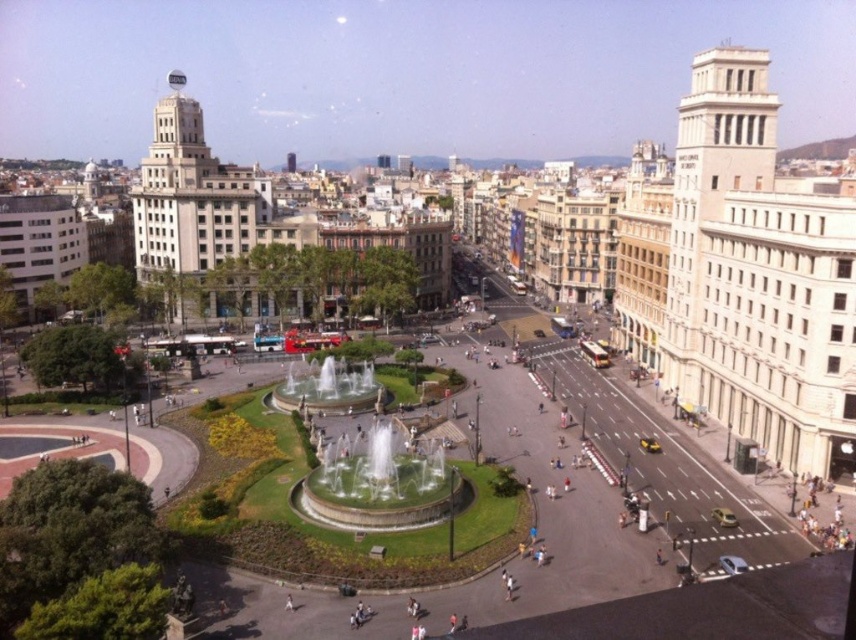
Question: In this image, where is white marble fountain at center located relative to polished stone fountain at center?

Choices:
 (A) left
 (B) right

Answer: (B)

Question: Which point is closer to the camera?

Choices:
 (A) (328, 468)
 (B) (373, 380)

Answer: (A)

Question: Can you confirm if white marble fountain at center is positioned to the right of polished stone fountain at center?

Choices:
 (A) no
 (B) yes

Answer: (B)

Question: Is white marble fountain at center bigger than polished stone fountain at center?

Choices:
 (A) no
 (B) yes

Answer: (B)

Question: Which point is closer to the camera?

Choices:
 (A) (308, 380)
 (B) (342, 435)

Answer: (B)